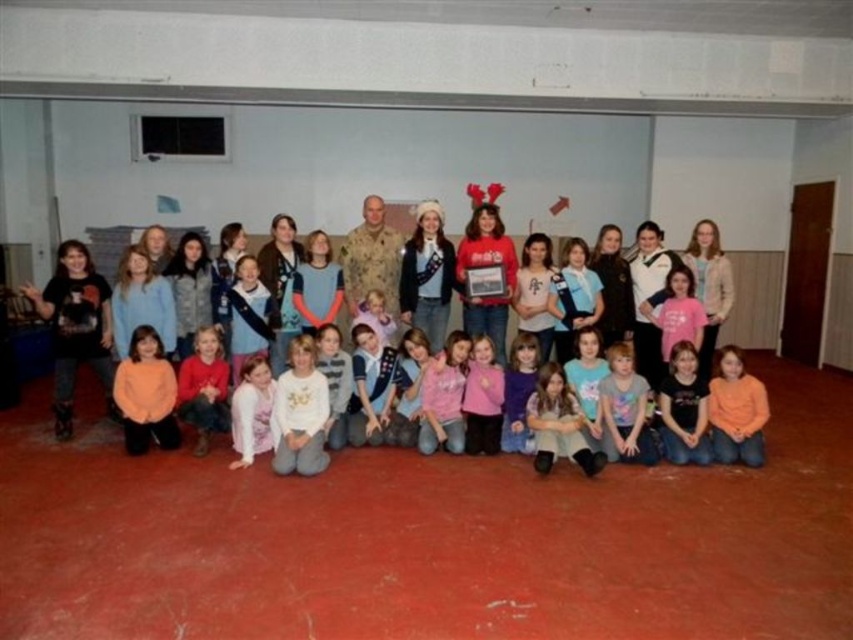
Question: Which is nearer to the purple velvet dress at center?

Choices:
 (A) matte black jacket at center
 (B) camouflage uniform at center
 (C) matte red sweater at lower center
 (D) orange fleece sweater at lower left

Answer: (B)

Question: Among these points, which one is nearest to the camera?

Choices:
 (A) (537, 348)
 (B) (213, 396)
 (C) (576, 410)

Answer: (C)

Question: Does matte black jacket at center appear under black matte shirt at lower center?

Choices:
 (A) no
 (B) yes

Answer: (A)

Question: Is the position of matte pink sweater at center more distant than that of purple velvet dress at center?

Choices:
 (A) no
 (B) yes

Answer: (A)

Question: Based on their relative distances, which object is nearer to the orange fleece sweater at lower left?

Choices:
 (A) matte black jacket at center
 (B) purple velvet dress at center

Answer: (B)

Question: Considering the relative positions of orange fleece sweater at lower left and purple velvet dress at center in the image provided, where is orange fleece sweater at lower left located with respect to purple velvet dress at center?

Choices:
 (A) right
 (B) left

Answer: (B)